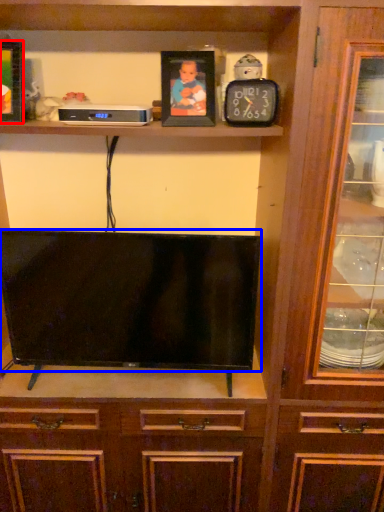
Question: Which of the following is the closest to the observer, picture frame (highlighted by a red box) or television (highlighted by a blue box)?

Choices:
 (A) picture frame
 (B) television

Answer: (A)